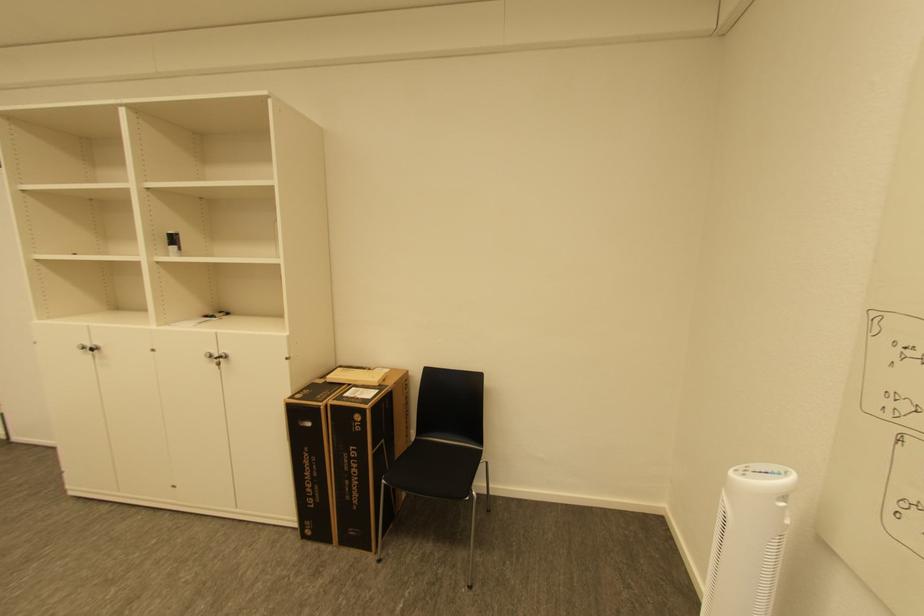
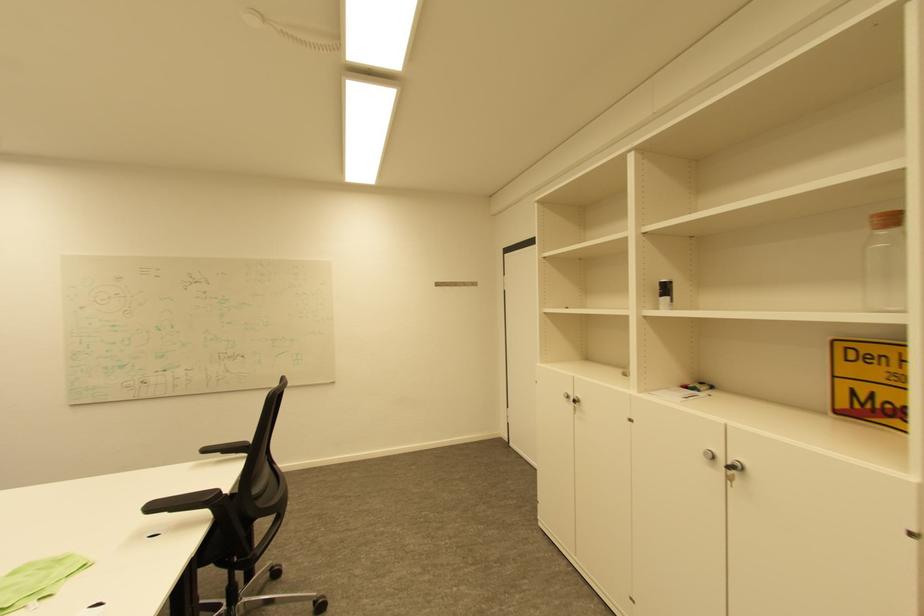
The point at [213,355] is marked in the first image. Where is the corresponding point in the second image?

(711, 453)